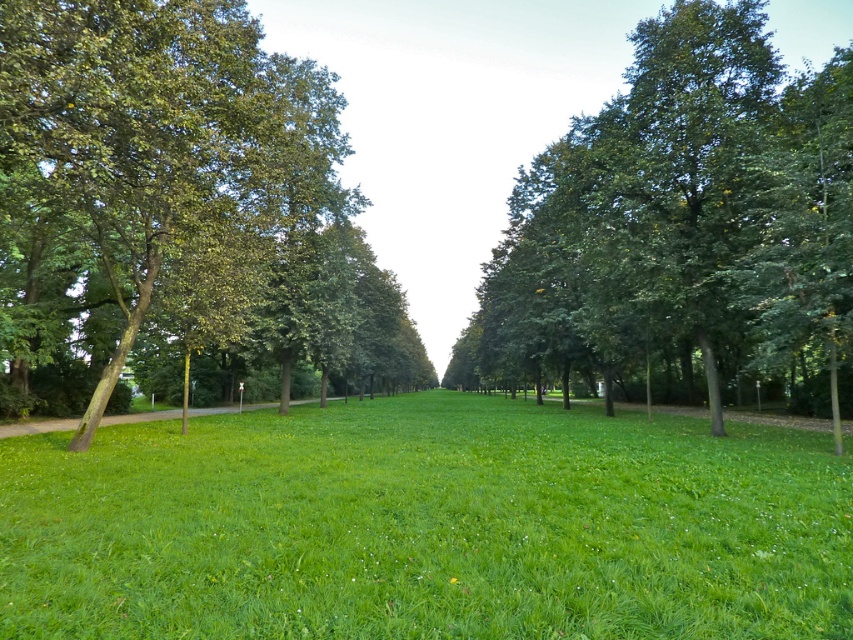
You are a park visitor standing at the entrance of the park. You see the green leafy tree at left and the green leafy tree at center. Which tree would you need to look up at more to see the top?

The green leafy tree at center is taller than the green leafy tree at left, so you would need to look up more to see the top of the green leafy tree at center.

You are standing at the center of the park and see the point marked as point (x=177, y=211). What is the nearest object to this point?

The point (x=177, y=211) marks the green leafy tree at left, so the nearest object to this point is the green leafy tree at left itself.